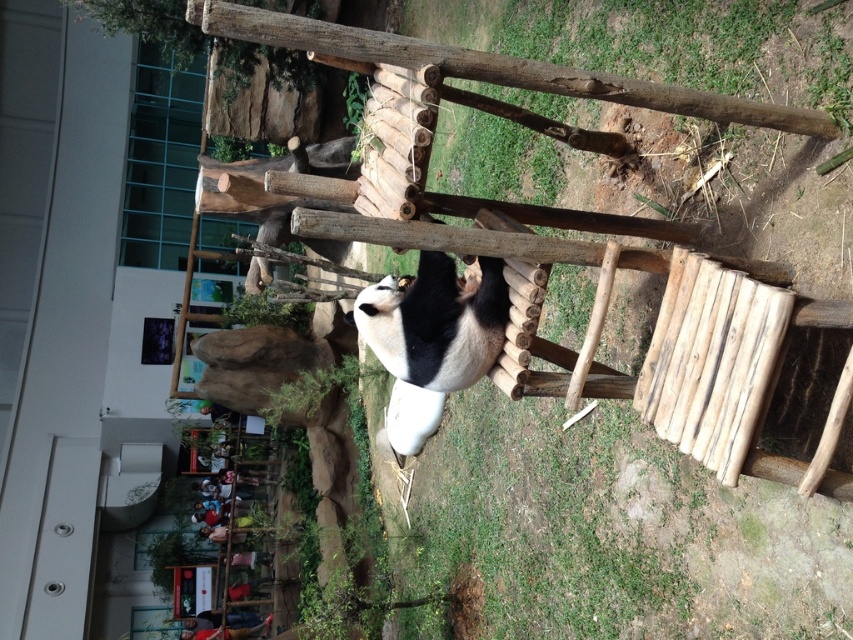
Is black and white fur at center further to the viewer compared to wooden ladder at lower left?

No, black and white fur at center is in front of wooden ladder at lower left.

Does point (369, 300) come in front of point (228, 588)?

Yes, it is in front of point (228, 588).

Find the location of a particular element. This screenshot has width=853, height=640. black and white fur at center is located at coordinates (434, 323).